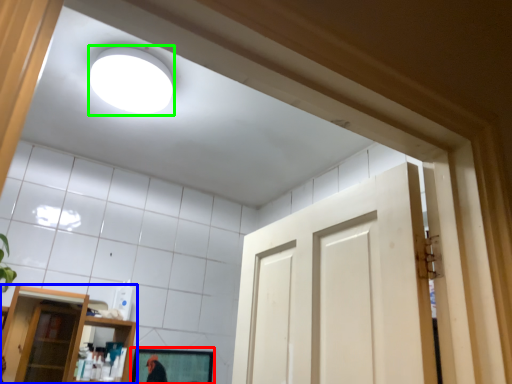
Question: Estimate the real-world distances between objects in this image. Which object is farther from mirror (highlighted by a red box), shelf (highlighted by a blue box) or lighting (highlighted by a green box)?

Choices:
 (A) shelf
 (B) lighting

Answer: (A)